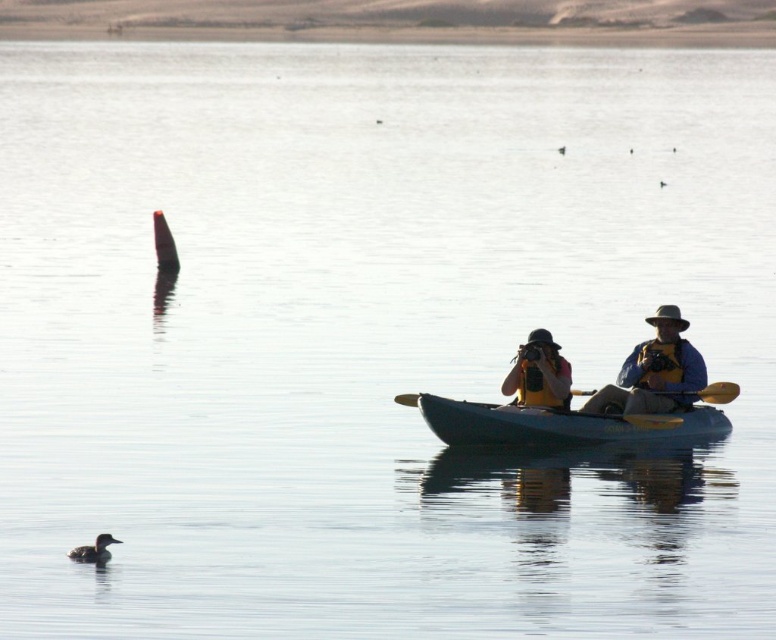
Does point (639, 429) come behind point (529, 352)?

That is False.

Which is below, blue plastic kayak at center or matte yellow kayak at center?

blue plastic kayak at center is lower down.

Who is more forward, (676, 413) or (566, 396)?

Positioned in front is point (566, 396).

Locate an element on the screen. This screenshot has height=640, width=776. blue plastic kayak at center is located at coordinates (556, 422).

Locate an element on the screen. blue plastic kayak at center is located at coordinates (556, 422).

Is blue plastic kayak at center positioned before brown fuzzy duck at lower left?

No, it is not.

Is blue plastic kayak at center to the right of brown fuzzy duck at lower left from the viewer's perspective?

Yes, blue plastic kayak at center is to the right of brown fuzzy duck at lower left.

Measure the distance between point (442, 428) and camera.

Point (442, 428) and camera are 18.49 meters apart.

Locate an element on the screen. Image resolution: width=776 pixels, height=640 pixels. blue plastic kayak at center is located at coordinates [x=556, y=422].